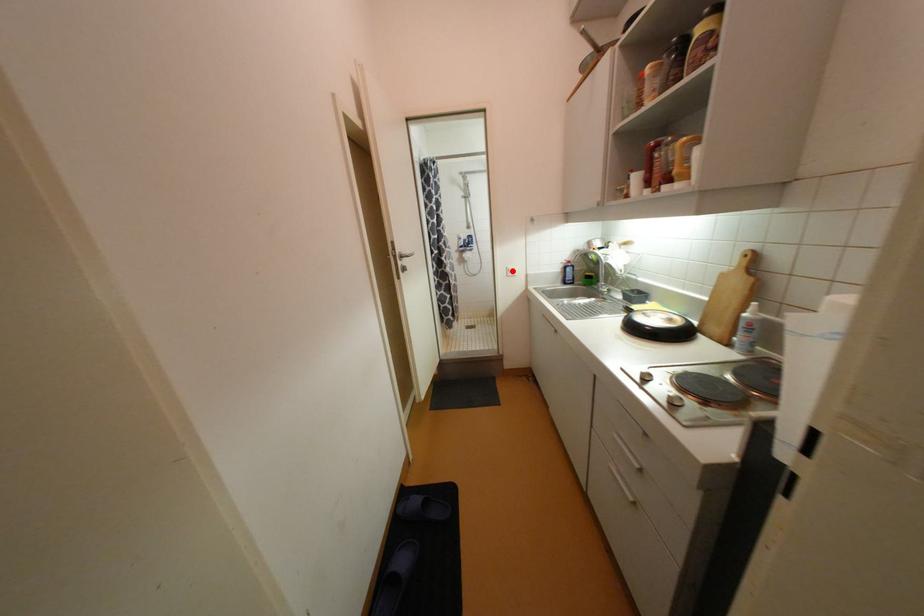
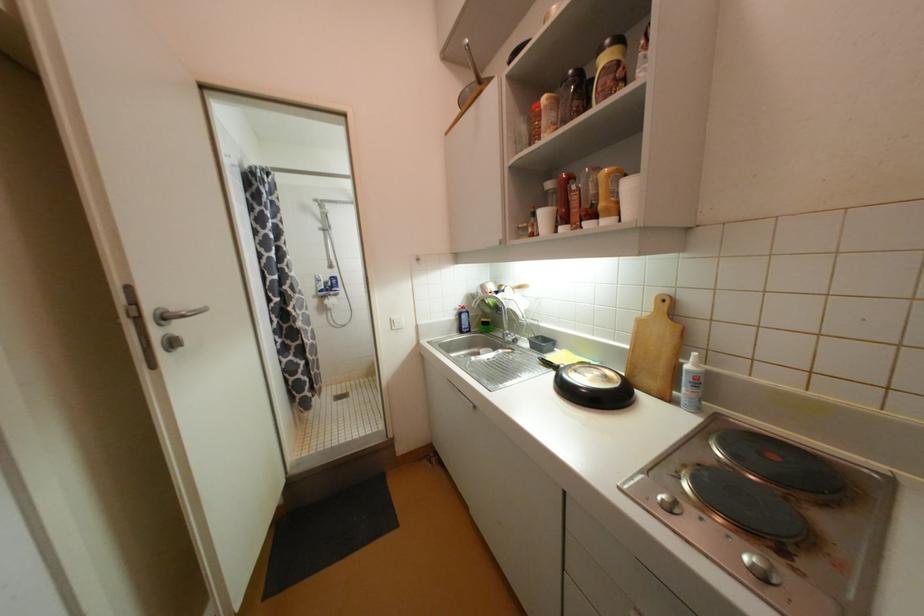
In the second image, find the point that corresponds to the highlighted location in the first image.

(396, 323)